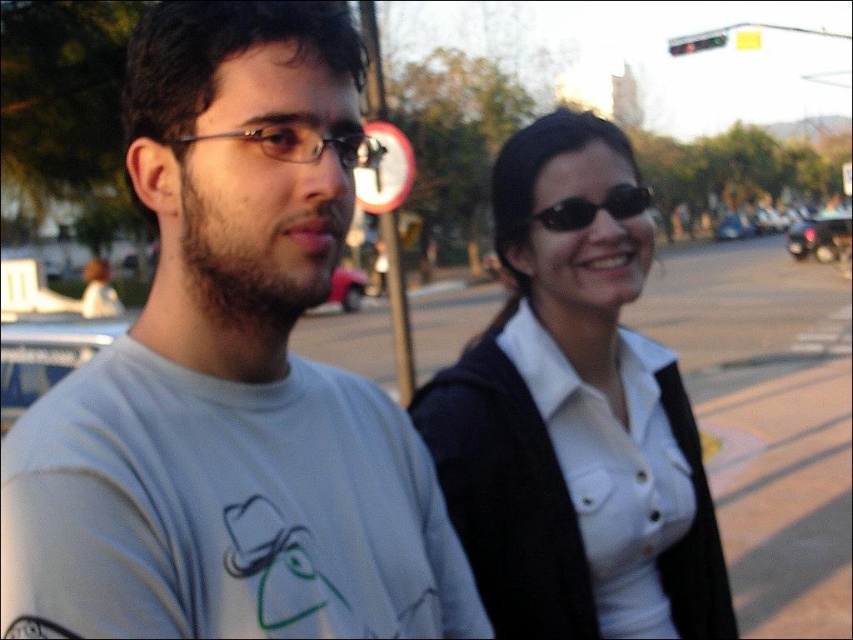
Question: Is white matte t-shirt at left smaller than clear plastic glasses at left?

Choices:
 (A) no
 (B) yes

Answer: (A)

Question: Based on their relative distances, which object is nearer to the white matte t-shirt at left?

Choices:
 (A) black reflective sunglasses at upper right
 (B) white matte shirt at center

Answer: (B)

Question: Which is farther from the white matte t-shirt at left?

Choices:
 (A) clear plastic glasses at left
 (B) black reflective sunglasses at upper right
 (C) white matte shirt at center

Answer: (A)

Question: Is white matte shirt at center bigger than black reflective sunglasses at upper right?

Choices:
 (A) no
 (B) yes

Answer: (B)

Question: Among these objects, which one is farthest from the camera?

Choices:
 (A) white matte shirt at center
 (B) clear plastic glasses at left

Answer: (B)

Question: Is white matte shirt at center wider than black reflective sunglasses at upper right?

Choices:
 (A) yes
 (B) no

Answer: (A)